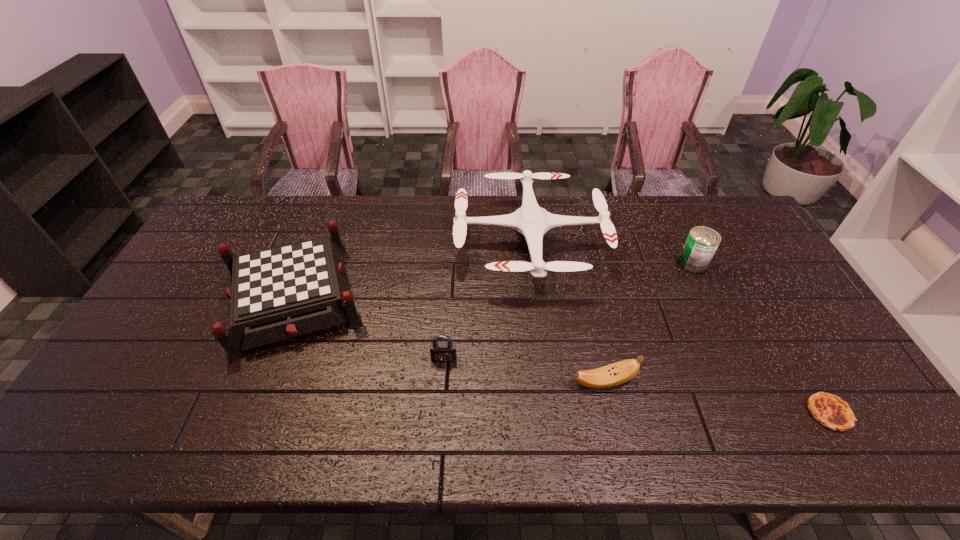
Where is `vacant area at the near edge`? The width and height of the screenshot is (960, 540). vacant area at the near edge is located at coordinates (294, 428).

What are the coordinates of `vacant space at the right edge of the desktop` in the screenshot? It's located at (780, 281).

Where is `vacant region at the far right corner of the desktop`? vacant region at the far right corner of the desktop is located at coordinates (728, 218).

Where is `free space between the second object from right to left and the drone`? free space between the second object from right to left and the drone is located at coordinates (611, 253).

The image size is (960, 540). I want to click on vacant area between the padlock and the leftmost object, so tap(369, 327).

Locate an element on the screen. free spot between the drone and the second nearest object is located at coordinates (566, 312).

Image resolution: width=960 pixels, height=540 pixels. I want to click on empty space between the padlock and the drone, so click(487, 300).

Where is `free space between the padlock and the leftmost object`? The image size is (960, 540). free space between the padlock and the leftmost object is located at coordinates (369, 327).

The height and width of the screenshot is (540, 960). In order to click on free spot between the drone and the nearest object in this screenshot , I will do `click(680, 328)`.

Locate an element on the screen. This screenshot has width=960, height=540. free spot between the banana and the quiche is located at coordinates (716, 397).